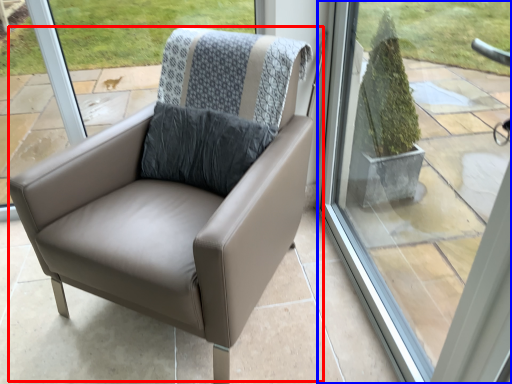
Question: Which point is further to the camera, chair (highlighted by a red box) or window (highlighted by a blue box)?

Choices:
 (A) chair
 (B) window

Answer: (A)